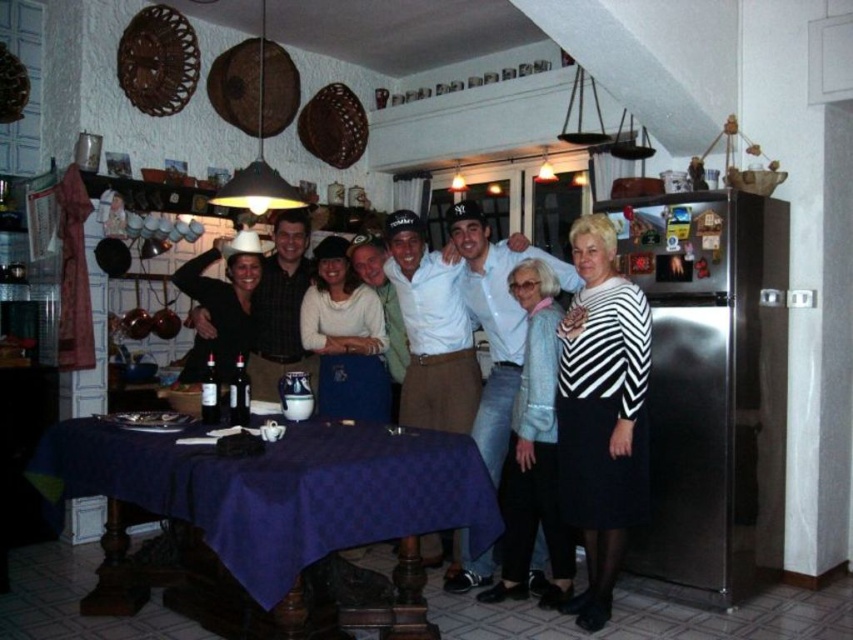
You are a guest at this gathering and want to pick up both the matte white shirt at center and the striped fabric sweater at right. How far apart are they?

The matte white shirt at center and the striped fabric sweater at right are 6.21 inches apart.

You are organizing a closet and see the matte white shirt at center and the striped fabric sweater at right. Which item is positioned higher up?

The matte white shirt at center is located above the striped fabric sweater at right, so it is positioned higher up.